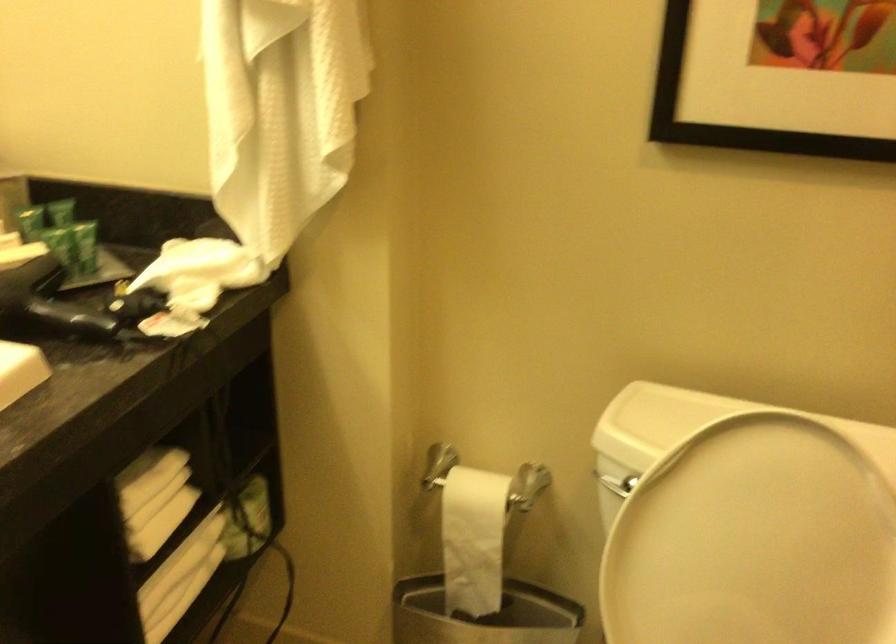
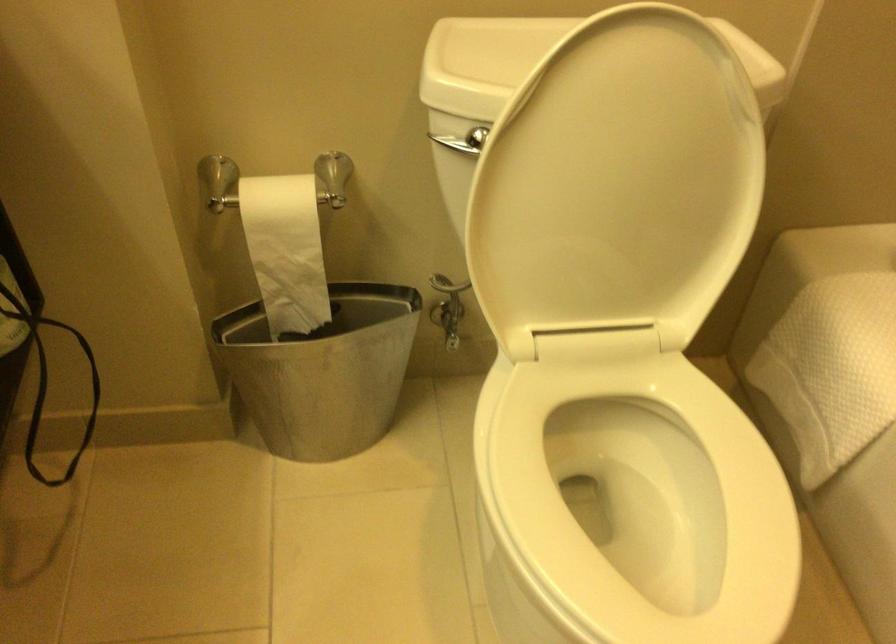
Where in the second image is the point corresponding to point (474, 536) from the first image?

(286, 250)